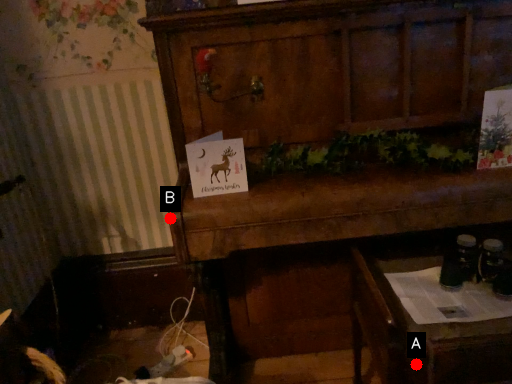
Question: Two points are circled on the image, labeled by A and B beside each circle. Among these points, which one is nearest to the camera?

Choices:
 (A) A is closer
 (B) B is closer

Answer: (A)